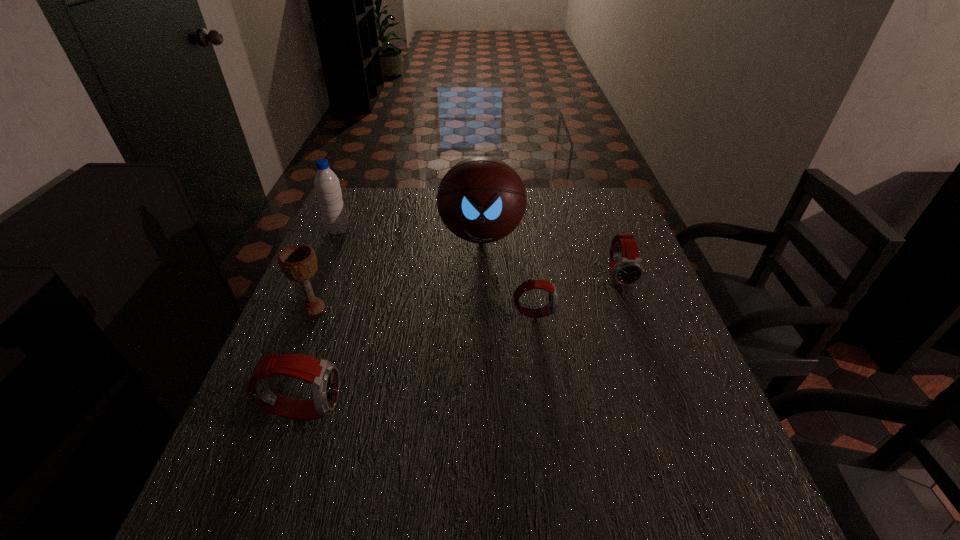
The width and height of the screenshot is (960, 540). Find the location of `chalice at the left edge`. chalice at the left edge is located at coordinates (298, 262).

Locate an element on the screen. The width and height of the screenshot is (960, 540). object situated at the right edge is located at coordinates (626, 268).

The image size is (960, 540). Find the location of `object that is at the far left corner`. object that is at the far left corner is located at coordinates click(327, 186).

Find the location of a particular element. This screenshot has height=540, width=960. object present at the near left corner is located at coordinates (323, 377).

What are the coordinates of `vacant space at the far edge of the desktop` in the screenshot? It's located at (392, 218).

In the image, there is a desktop. Identify the location of free region at the left edge. The height and width of the screenshot is (540, 960). (321, 317).

Locate an element on the screen. The width and height of the screenshot is (960, 540). vacant space at the right edge of the desktop is located at coordinates (660, 380).

I want to click on vacant space at the far left corner of the desktop, so click(x=347, y=195).

Find the location of a particular element. vacant space at the far right corner is located at coordinates (588, 220).

Identify the location of blank space at the near right corner of the desktop. The width and height of the screenshot is (960, 540). (636, 430).